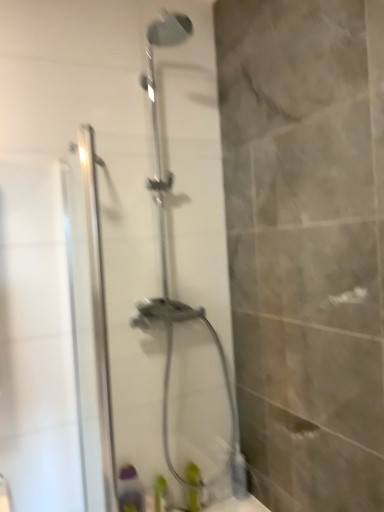
Question: Is green plastic bottle at lower center, acting as the second toiletry starting from the right, aimed at green matte bottle at lower center, placed as the first toiletry when sorted from right to left?

Choices:
 (A) yes
 (B) no

Answer: (B)

Question: Does green plastic bottle at lower center, placed as the first toiletry when sorted from left to right, have a lesser height compared to green matte bottle at lower center, which is the 2th toiletry from left to right?

Choices:
 (A) no
 (B) yes

Answer: (B)

Question: Considering the relative sizes of green plastic bottle at lower center, acting as the second toiletry starting from the right, and green matte bottle at lower center, which is the 2th toiletry from left to right, in the image provided, is green plastic bottle at lower center, acting as the second toiletry starting from the right, thinner than green matte bottle at lower center, which is the 2th toiletry from left to right,?

Choices:
 (A) no
 (B) yes

Answer: (A)

Question: Considering the relative positions of green plastic bottle at lower center, acting as the second toiletry starting from the right, and green matte bottle at lower center, which is the 2th toiletry from left to right, in the image provided, is green plastic bottle at lower center, acting as the second toiletry starting from the right, to the left of green matte bottle at lower center, which is the 2th toiletry from left to right, from the viewer's perspective?

Choices:
 (A) yes
 (B) no

Answer: (A)

Question: Is green plastic bottle at lower center, placed as the first toiletry when sorted from left to right, smaller than green matte bottle at lower center, which is the 2th toiletry from left to right?

Choices:
 (A) no
 (B) yes

Answer: (A)

Question: Considering the relative sizes of green plastic bottle at lower center, placed as the first toiletry when sorted from left to right, and green matte bottle at lower center, placed as the first toiletry when sorted from right to left, in the image provided, is green plastic bottle at lower center, placed as the first toiletry when sorted from left to right, wider than green matte bottle at lower center, placed as the first toiletry when sorted from right to left,?

Choices:
 (A) yes
 (B) no

Answer: (A)

Question: Is green plastic bottle at lower center, acting as the second toiletry starting from the right, to the left of clear glass shower door at center from the viewer's perspective?

Choices:
 (A) yes
 (B) no

Answer: (A)

Question: From the image's perspective, is green plastic bottle at lower center, acting as the second toiletry starting from the right, located above clear glass shower door at center?

Choices:
 (A) no
 (B) yes

Answer: (A)

Question: Considering the relative sizes of green plastic bottle at lower center, acting as the second toiletry starting from the right, and clear glass shower door at center in the image provided, is green plastic bottle at lower center, acting as the second toiletry starting from the right, smaller than clear glass shower door at center?

Choices:
 (A) no
 (B) yes

Answer: (B)

Question: Does green plastic bottle at lower center, acting as the second toiletry starting from the right, come behind clear glass shower door at center?

Choices:
 (A) no
 (B) yes

Answer: (B)

Question: Considering the relative sizes of green plastic bottle at lower center, acting as the second toiletry starting from the right, and clear glass shower door at center in the image provided, is green plastic bottle at lower center, acting as the second toiletry starting from the right, taller than clear glass shower door at center?

Choices:
 (A) no
 (B) yes

Answer: (A)

Question: From the image's perspective, is green matte bottle at lower center, which is the 2th toiletry from left to right, below green plastic bottle at lower center, acting as the second toiletry starting from the right?

Choices:
 (A) yes
 (B) no

Answer: (B)